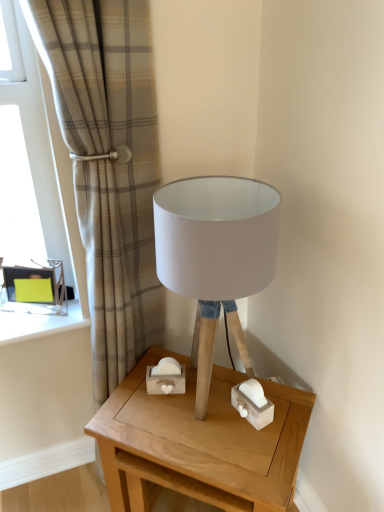
Where is `unoccupied area in front of white fabric lampshade at center`? This screenshot has width=384, height=512. unoccupied area in front of white fabric lampshade at center is located at coordinates (226, 449).